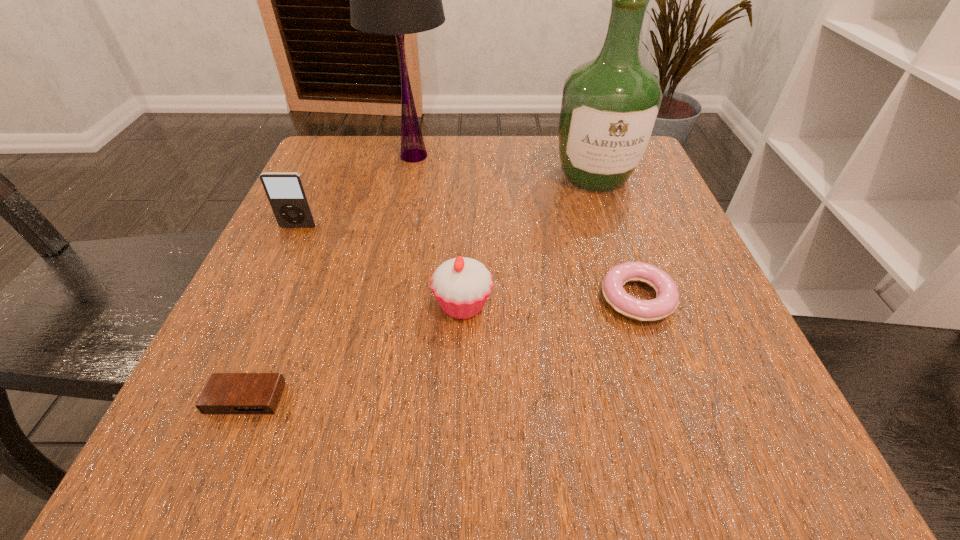
Where is `lampshade`? The image size is (960, 540). lampshade is located at coordinates point(396,0).

Locate an element on the screen. liquor is located at coordinates 610,105.

Find the location of a particular element. Image resolution: width=960 pixels, height=540 pixels. the third tallest object is located at coordinates (286, 192).

At what (x,y) coordinates should I click in order to perform the action: click on iPod. Please return your answer as a coordinate pair (x, y). The height and width of the screenshot is (540, 960). Looking at the image, I should click on (286, 192).

Locate an element on the screen. The height and width of the screenshot is (540, 960). cupcake is located at coordinates (462, 285).

Where is `the fifth tallest object`? the fifth tallest object is located at coordinates (667, 299).

This screenshot has width=960, height=540. Find the location of `alarm clock`. alarm clock is located at coordinates (225, 393).

This screenshot has width=960, height=540. Find the location of `the nearest object`. the nearest object is located at coordinates (225, 393).

The image size is (960, 540). I want to click on vacant position located on the front-facing side of the lampshade, so click(500, 156).

Locate an element on the screen. The image size is (960, 540). free location located on the front-facing side of the liquor is located at coordinates (631, 285).